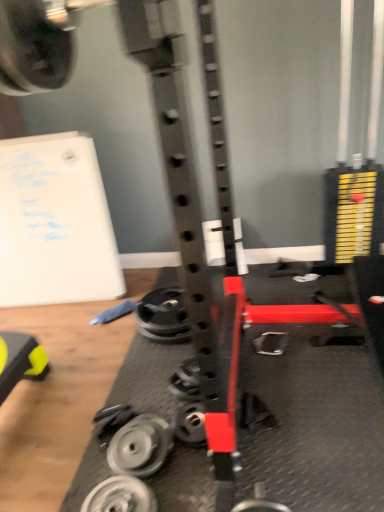
Question: Is there a large distance between silver metallic weight at lower center, which is counted as the 4th wheel, starting from the back, and metallic silver weight at center, arranged as the first wheel when viewed from the back?

Choices:
 (A) no
 (B) yes

Answer: (A)

Question: Would you say silver metallic weight at lower center, placed as the 4th wheel when sorted from top to bottom, is outside metallic silver weight at center, which appears as the fourth wheel when viewed from the front?

Choices:
 (A) yes
 (B) no

Answer: (A)

Question: From a real-world perspective, is silver metallic weight at lower center, placed as the 4th wheel when sorted from top to bottom, located beneath metallic silver weight at center, which appears as the fourth wheel when viewed from the front?

Choices:
 (A) yes
 (B) no

Answer: (B)

Question: Can metallic silver weight at center, arranged as the first wheel when viewed from the back, be found inside silver metallic weight at lower center, which is the first wheel from bottom to top?

Choices:
 (A) no
 (B) yes

Answer: (A)

Question: Is silver metallic weight at lower center, which is the first wheel from bottom to top, bigger than metallic silver weight at center, which appears as the fourth wheel when viewed from the front?

Choices:
 (A) yes
 (B) no

Answer: (B)

Question: Is silver metallic weight at lower center, placed as the 4th wheel when sorted from top to bottom, at the right side of metallic silver weight at center, arranged as the first wheel when viewed from the back?

Choices:
 (A) yes
 (B) no

Answer: (B)

Question: Considering the relative sizes of metallic silver weight at center, the fourth wheel in the bottom-to-top sequence, and silver metallic weight at lower center, marked as the first wheel in a front-to-back arrangement, in the image provided, is metallic silver weight at center, the fourth wheel in the bottom-to-top sequence, shorter than silver metallic weight at lower center, marked as the first wheel in a front-to-back arrangement,?

Choices:
 (A) no
 (B) yes

Answer: (A)

Question: Does metallic silver weight at center, the 1th wheel positioned from the top, have a lesser width compared to silver metallic weight at lower center, which is counted as the 4th wheel, starting from the back?

Choices:
 (A) no
 (B) yes

Answer: (A)

Question: Could you tell me if metallic silver weight at center, arranged as the first wheel when viewed from the back, is facing silver metallic weight at lower center, which is the first wheel from bottom to top?

Choices:
 (A) no
 (B) yes

Answer: (B)

Question: Can you see metallic silver weight at center, the 1th wheel positioned from the top, touching silver metallic weight at lower center, which is counted as the 4th wheel, starting from the back?

Choices:
 (A) no
 (B) yes

Answer: (A)

Question: Is silver metallic weight at lower center, placed as the 4th wheel when sorted from top to bottom, at the back of metallic silver weight at center, which appears as the fourth wheel when viewed from the front?

Choices:
 (A) no
 (B) yes

Answer: (A)

Question: Is metallic silver weight at center, the 1th wheel positioned from the top, behind silver metallic weight at lower center, which is the first wheel from bottom to top?

Choices:
 (A) yes
 (B) no

Answer: (A)

Question: Is metallic silver wheel at center, placed as the second wheel when sorted from back to front, positioned before metallic silver weight at center, the 1th wheel positioned from the top?

Choices:
 (A) yes
 (B) no

Answer: (A)